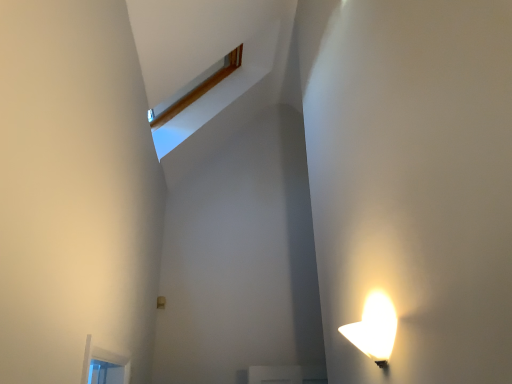
What do you see at coordinates (374, 329) in the screenshot? I see `white glossy wall sconce at lower right` at bounding box center [374, 329].

The width and height of the screenshot is (512, 384). In order to click on white glossy wall sconce at lower right in this screenshot , I will do `click(374, 329)`.

Where is `white glossy wall sconce at lower right`? The image size is (512, 384). white glossy wall sconce at lower right is located at coordinates (374, 329).